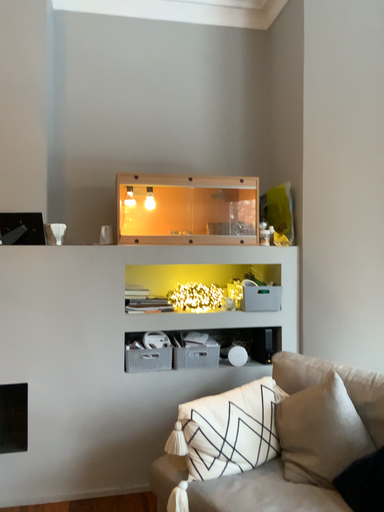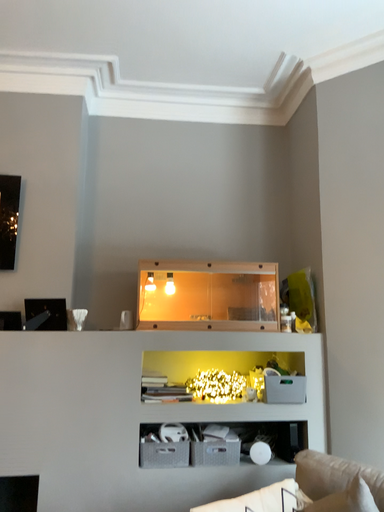
Question: Which way did the camera rotate in the video?

Choices:
 (A) rotated downward
 (B) rotated upward

Answer: (B)